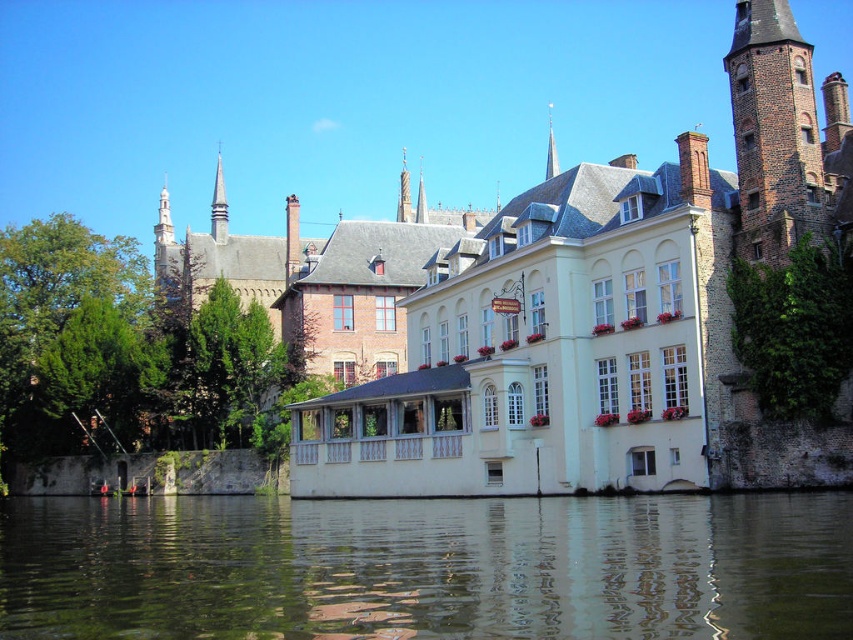
Question: Among these objects, which one is farthest from the camera?

Choices:
 (A) brown brick tower at upper right
 (B) white stone building at center
 (C) green reflective water at center

Answer: (A)

Question: Observing the image, what is the correct spatial positioning of white stone building at center in reference to green reflective water at center?

Choices:
 (A) right
 (B) left

Answer: (B)

Question: Which point is closer to the camera?

Choices:
 (A) green reflective water at center
 (B) brown brick tower at upper right

Answer: (A)

Question: Can you confirm if white stone building at center is bigger than brown brick tower at upper right?

Choices:
 (A) yes
 (B) no

Answer: (A)

Question: Does white stone building at center appear on the left side of green reflective water at center?

Choices:
 (A) yes
 (B) no

Answer: (A)

Question: Based on their relative distances, which object is farther from the brown brick tower at upper right?

Choices:
 (A) white stone building at center
 (B) green reflective water at center

Answer: (A)